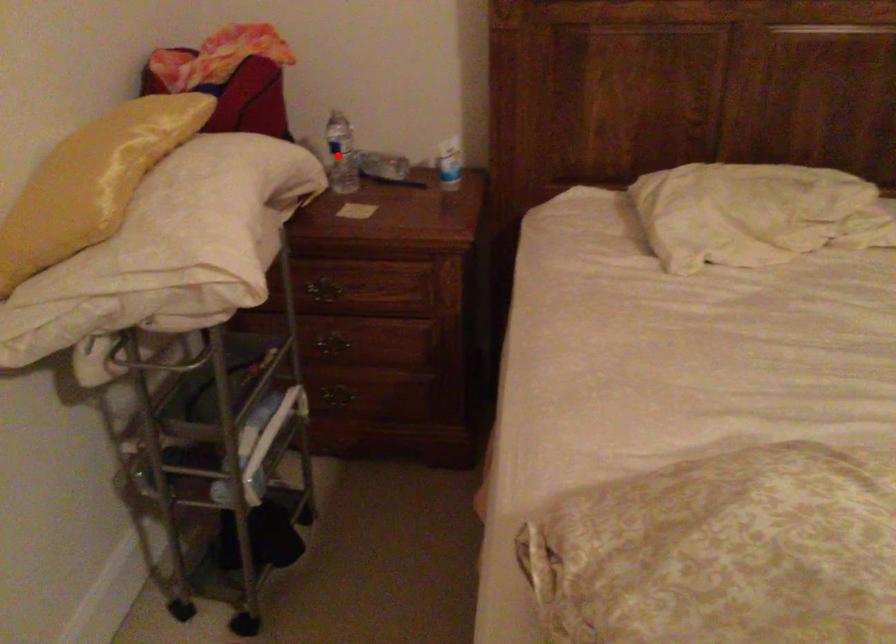
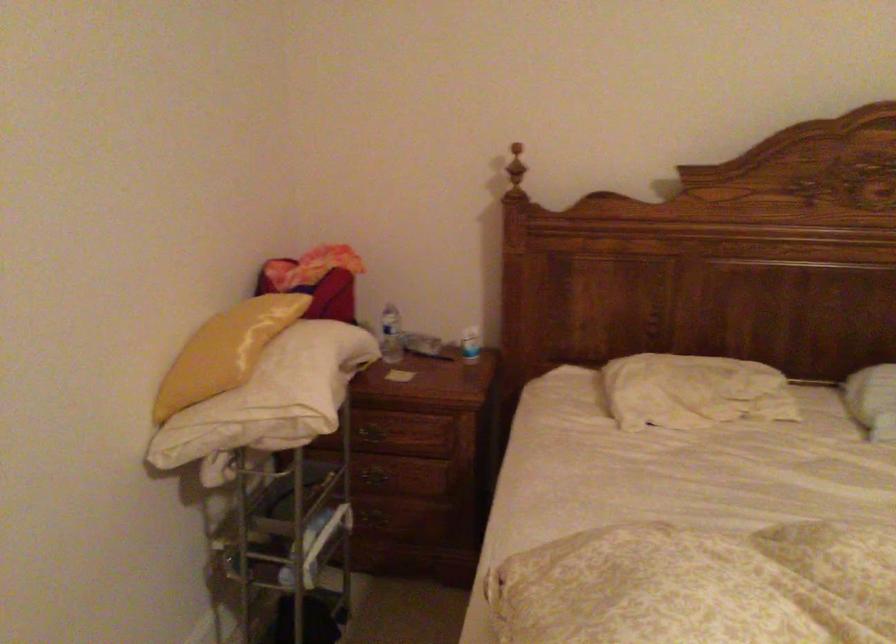
Question: I am providing you with two images of the same scene from different viewpoints. A red point is shown in image1. For the corresponding object point in image2, is it positioned nearer or farther from the camera?

Choices:
 (A) Nearer
 (B) Farther

Answer: (B)